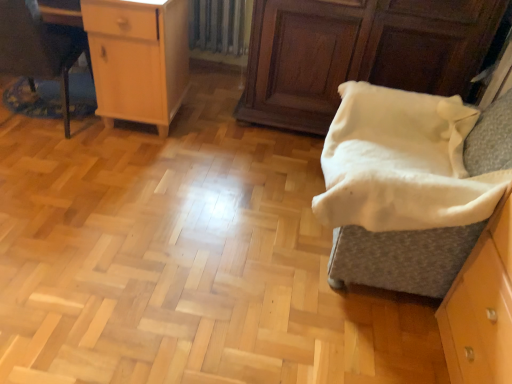
The width and height of the screenshot is (512, 384). Describe the element at coordinates (358, 53) in the screenshot. I see `wooden cabinet at upper right` at that location.

The width and height of the screenshot is (512, 384). What do you see at coordinates (138, 58) in the screenshot?
I see `light wood cabinet at upper left` at bounding box center [138, 58].

Identify the location of white soft blanket at right. The image size is (512, 384). (399, 162).

Is point (460, 131) positioned after point (51, 40)?

No.

Is white soft blanket at right looking in the opposite direction of brushed metal desk at left?

That's not correct — white soft blanket at right is not looking away from brushed metal desk at left.

From the picture: Considering the sizes of objects white soft blanket at right and brushed metal desk at left in the image provided, who is smaller, white soft blanket at right or brushed metal desk at left?

With smaller size is white soft blanket at right.

Considering the sizes of objects brushed metal desk at left and light wood cabinet at upper left in the image provided, who is taller, brushed metal desk at left or light wood cabinet at upper left?

With more height is brushed metal desk at left.

From a real-world perspective, is brushed metal desk at left beneath light wood cabinet at upper left?

Correct, in the physical world, brushed metal desk at left is lower than light wood cabinet at upper left.

Is the depth of brushed metal desk at left less than that of light wood cabinet at upper left?

Yes, it is.

How different are the orientations of white soft blanket at right and wooden cabinet at upper right in degrees?

There is a 87.5-degree angle between the facing directions of white soft blanket at right and wooden cabinet at upper right.

From the image's perspective, is white soft blanket at right below wooden cabinet at upper right?

Indeed, from the image's perspective, white soft blanket at right is shown beneath wooden cabinet at upper right.

From a real-world perspective, is white soft blanket at right located beneath wooden cabinet at upper right?

No, from a real-world perspective, white soft blanket at right is not below wooden cabinet at upper right.

Would you say white soft blanket at right is to the left or to the right of wooden cabinet at upper right in the picture?

white soft blanket at right is positioned on wooden cabinet at upper right's left side.

From the image's perspective, is light wood cabinet at upper left above brushed metal desk at left?

Yes, from the image's perspective, light wood cabinet at upper left is over brushed metal desk at left.

Is light wood cabinet at upper left in front of or behind brushed metal desk at left in the image?

Clearly, light wood cabinet at upper left is behind brushed metal desk at left.

Is light wood cabinet at upper left oriented away from brushed metal desk at left?

Yes, light wood cabinet at upper left is facing away from brushed metal desk at left.

In terms of width, does light wood cabinet at upper left look wider or thinner when compared to brushed metal desk at left?

Considering their sizes, light wood cabinet at upper left looks slimmer than brushed metal desk at left.

In the image, is white soft blanket at right on the left side or the right side of light wood cabinet at upper left?

white soft blanket at right is to the right of light wood cabinet at upper left.

From the image's perspective, is white soft blanket at right on top of light wood cabinet at upper left?

No, from the image's perspective, white soft blanket at right is not above light wood cabinet at upper left.

Does point (391, 176) come farther from viewer compared to point (132, 0)?

No, (391, 176) is in front of (132, 0).

From a real-world perspective, does light wood cabinet at upper left stand above white soft blanket at right?

Incorrect, from a real-world perspective, light wood cabinet at upper left is lower than white soft blanket at right.

Which of these two, light wood cabinet at upper left or white soft blanket at right, is wider?

With larger width is white soft blanket at right.

Between light wood cabinet at upper left and white soft blanket at right, which one has more height?

With more height is light wood cabinet at upper left.

What are the coordinates of `blanket below the light wood cabinet at upper left (from the image's perspective)` in the screenshot? It's located at (399, 162).

Consider the image. Can you confirm if metallic silver radiator at upper center is positioned to the right of white soft blanket at right?

No, metallic silver radiator at upper center is not to the right of white soft blanket at right.

Is metallic silver radiator at upper center completely or partially outside of white soft blanket at right?

Yes, metallic silver radiator at upper center is located beyond the bounds of white soft blanket at right.

Can you confirm if metallic silver radiator at upper center is wider than white soft blanket at right?

No.

Considering the points (244, 8) and (441, 119), which point is in front, point (244, 8) or point (441, 119)?

The point (441, 119) is more forward.

I want to click on blanket positioned vertically above the brushed metal desk at left (from a real-world perspective), so point(399,162).

Identify the location of furniture in front of the light wood cabinet at upper left. (38, 48).

In the scene shown: Estimate the real-world distances between objects in this image. Which object is closer to wooden cabinet at upper right, brushed metal desk at left or white soft blanket at right?

Among the two, white soft blanket at right is located nearer to wooden cabinet at upper right.

From the picture: From the image, which object appears to be farther from metallic silver radiator at upper center, wooden cabinet at upper right or brushed metal desk at left?

Among the two, brushed metal desk at left is located further to metallic silver radiator at upper center.

Based on their spatial positions, is white soft blanket at right or metallic silver radiator at upper center closer to brushed metal desk at left?

metallic silver radiator at upper center is positioned closer to the anchor brushed metal desk at left.

Looking at the image, which one is located further to light wood cabinet at upper left, white soft blanket at right or metallic silver radiator at upper center?

white soft blanket at right is positioned further to the anchor light wood cabinet at upper left.

Estimate the real-world distances between objects in this image. Which object is closer to white soft blanket at right, brushed metal desk at left or light wood cabinet at upper left?

light wood cabinet at upper left.

Which object lies nearer to the anchor point white soft blanket at right, brushed metal desk at left or wooden cabinet at upper right?

Based on the image, wooden cabinet at upper right appears to be nearer to white soft blanket at right.

From the image, which object appears to be nearer to light wood cabinet at upper left, metallic silver radiator at upper center or white soft blanket at right?

Based on the image, metallic silver radiator at upper center appears to be nearer to light wood cabinet at upper left.

From the image, which object appears to be nearer to white soft blanket at right, wooden cabinet at upper right or brushed metal desk at left?

Based on the image, wooden cabinet at upper right appears to be nearer to white soft blanket at right.

What are the coordinates of `blanket between brushed metal desk at left and wooden cabinet at upper right from left to right` in the screenshot? It's located at (399, 162).

Find the location of `radiator situated between brushed metal desk at left and wooden cabinet at upper right from left to right`. radiator situated between brushed metal desk at left and wooden cabinet at upper right from left to right is located at coordinates (219, 25).

Image resolution: width=512 pixels, height=384 pixels. I want to click on blanket situated between light wood cabinet at upper left and wooden cabinet at upper right from left to right, so click(x=399, y=162).

Where is `the chest of drawers located between brushed metal desk at left and wooden cabinet at upper right in the left-right direction`? the chest of drawers located between brushed metal desk at left and wooden cabinet at upper right in the left-right direction is located at coordinates (138, 58).